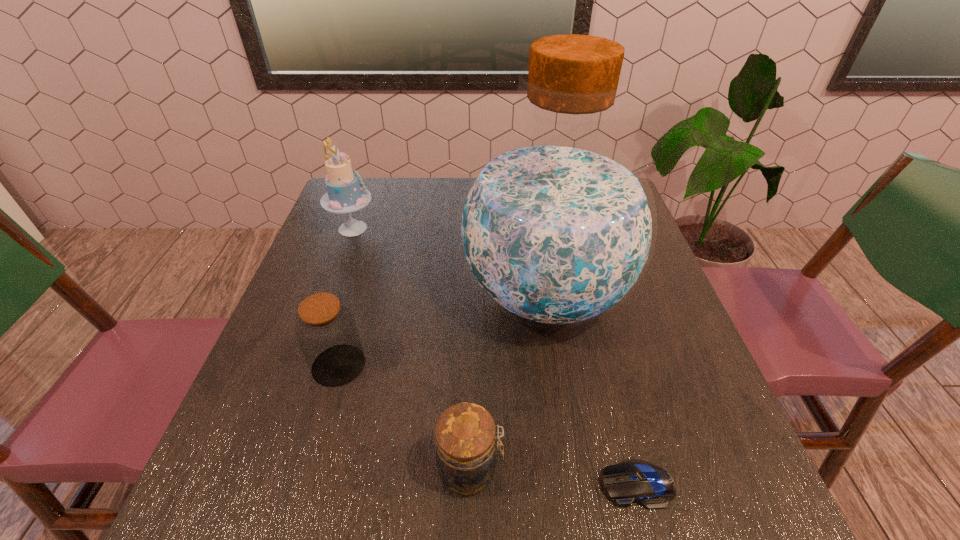
I want to click on vacant space that satisfies the following two spatial constraints: 1. with a ladder on the side of the farthest object; 2. on the left side of the farther jar, so click(303, 365).